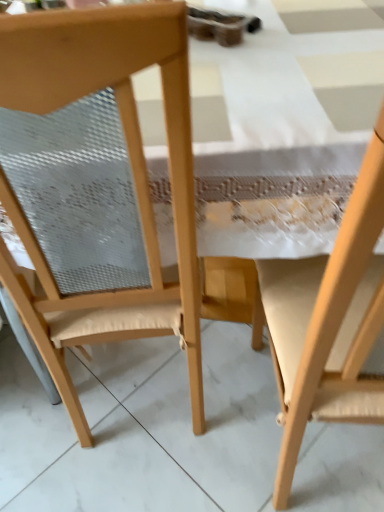
At what (x,y) coordinates should I click in order to perform the action: click on wooden chair at left, arranged as the 2th chair when viewed from the right. Please return your answer as a coordinate pair (x, y). The height and width of the screenshot is (512, 384). Looking at the image, I should click on (95, 184).

What do you see at coordinates (95, 184) in the screenshot? This screenshot has width=384, height=512. I see `wooden chair at left, arranged as the 2th chair when viewed from the right` at bounding box center [95, 184].

You are a GUI agent. You are given a task and a screenshot of the screen. Output one action in this format:
    pyautogui.click(x=<x>, y=<y>)
    Task: Click on the wooden chair at right, marked as the first chair in a right-to-left arrangement
    
    Given the screenshot: What is the action you would take?
    pyautogui.click(x=330, y=322)

Image resolution: width=384 pixels, height=512 pixels. Describe the element at coordinates (330, 322) in the screenshot. I see `wooden chair at right, which is the second chair from left to right` at that location.

Where is `wooden chair at left, arranged as the 2th chair when viewed from the right`? Image resolution: width=384 pixels, height=512 pixels. wooden chair at left, arranged as the 2th chair when viewed from the right is located at coordinates (95, 184).

Would you say wooden chair at left, arranged as the 2th chair when viewed from the right, is to the left or to the right of wooden chair at right, marked as the first chair in a right-to-left arrangement, in the picture?

wooden chair at left, arranged as the 2th chair when viewed from the right, is to the left of wooden chair at right, marked as the first chair in a right-to-left arrangement.

Relative to wooden chair at right, marked as the first chair in a right-to-left arrangement, is wooden chair at left, arranged as the 2th chair when viewed from the right, in front or behind?

In the image, wooden chair at left, arranged as the 2th chair when viewed from the right, appears behind wooden chair at right, marked as the first chair in a right-to-left arrangement.

Which point is more distant from viewer, (192, 298) or (301, 384)?

Positioned behind is point (192, 298).

From the image's perspective, would you say wooden chair at left, arranged as the 2th chair when viewed from the right, is shown under wooden chair at right, marked as the first chair in a right-to-left arrangement?

Incorrect, from the image's perspective, wooden chair at left, arranged as the 2th chair when viewed from the right, is higher than wooden chair at right, marked as the first chair in a right-to-left arrangement.

From a real-world perspective, does wooden chair at left, placed as the first chair when sorted from left to right, sit lower than wooden chair at right, marked as the first chair in a right-to-left arrangement?

Yes.

Between wooden chair at left, arranged as the 2th chair when viewed from the right, and wooden chair at right, marked as the first chair in a right-to-left arrangement, which one has smaller width?

With smaller width is wooden chair at left, arranged as the 2th chair when viewed from the right.

Can you confirm if wooden chair at left, arranged as the 2th chair when viewed from the right, is taller than wooden chair at right, marked as the first chair in a right-to-left arrangement?

Yes.

Does wooden chair at left, placed as the first chair when sorted from left to right, have a smaller size compared to wooden chair at right, which is the second chair from left to right?

Indeed, wooden chair at left, placed as the first chair when sorted from left to right, has a smaller size compared to wooden chair at right, which is the second chair from left to right.

Would you say wooden chair at left, arranged as the 2th chair when viewed from the right, is inside or outside wooden chair at right, marked as the first chair in a right-to-left arrangement?

wooden chair at left, arranged as the 2th chair when viewed from the right, is outside wooden chair at right, marked as the first chair in a right-to-left arrangement.

Does wooden chair at left, arranged as the 2th chair when viewed from the right, touch wooden chair at right, which is the second chair from left to right?

wooden chair at left, arranged as the 2th chair when viewed from the right, is not next to wooden chair at right, which is the second chair from left to right, and they're not touching.

Is wooden chair at left, arranged as the 2th chair when viewed from the right, positioned with its back to wooden chair at right, which is the second chair from left to right?

No, wooden chair at left, arranged as the 2th chair when viewed from the right, is not facing away from wooden chair at right, which is the second chair from left to right.

Locate an element on the screen. chair that is above the wooden chair at right, marked as the first chair in a right-to-left arrangement (from the image's perspective) is located at coordinates (95, 184).

Considering the relative positions of wooden chair at right, marked as the first chair in a right-to-left arrangement, and wooden chair at left, placed as the first chair when sorted from left to right, in the image provided, is wooden chair at right, marked as the first chair in a right-to-left arrangement, to the left or to the right of wooden chair at left, placed as the first chair when sorted from left to right,?

wooden chair at right, marked as the first chair in a right-to-left arrangement, is to the right of wooden chair at left, placed as the first chair when sorted from left to right.

Between wooden chair at right, marked as the first chair in a right-to-left arrangement, and wooden chair at left, placed as the first chair when sorted from left to right, which one is positioned behind?

Positioned behind is wooden chair at left, placed as the first chair when sorted from left to right.

Considering the points (301, 392) and (132, 106), which point is in front, point (301, 392) or point (132, 106)?

The point (132, 106) is closer to the camera.

In the scene shown: From the image's perspective, which object appears higher, wooden chair at right, which is the second chair from left to right, or wooden chair at left, placed as the first chair when sorted from left to right?

wooden chair at left, placed as the first chair when sorted from left to right, appears higher in the image.

From a real-world perspective, who is located lower, wooden chair at right, marked as the first chair in a right-to-left arrangement, or wooden chair at left, placed as the first chair when sorted from left to right?

wooden chair at left, placed as the first chair when sorted from left to right, is physically lower.

Can you confirm if wooden chair at right, which is the second chair from left to right, is thinner than wooden chair at left, placed as the first chair when sorted from left to right?

No, wooden chair at right, which is the second chair from left to right, is not thinner than wooden chair at left, placed as the first chair when sorted from left to right.

In terms of height, does wooden chair at right, marked as the first chair in a right-to-left arrangement, look taller or shorter compared to wooden chair at left, placed as the first chair when sorted from left to right?

In the image, wooden chair at right, marked as the first chair in a right-to-left arrangement, appears to be shorter than wooden chair at left, placed as the first chair when sorted from left to right.

From the picture: Which of these two, wooden chair at right, which is the second chair from left to right, or wooden chair at left, arranged as the 2th chair when viewed from the right, is smaller?

Smaller between the two is wooden chair at left, arranged as the 2th chair when viewed from the right.

Which is correct: wooden chair at right, marked as the first chair in a right-to-left arrangement, is inside wooden chair at left, arranged as the 2th chair when viewed from the right, or outside of it?

wooden chair at right, marked as the first chair in a right-to-left arrangement, is located beyond the bounds of wooden chair at left, arranged as the 2th chair when viewed from the right.

Is wooden chair at right, marked as the first chair in a right-to-left arrangement, not near wooden chair at left, arranged as the 2th chair when viewed from the right?

No, wooden chair at right, marked as the first chair in a right-to-left arrangement, is not far away from wooden chair at left, arranged as the 2th chair when viewed from the right.

Is wooden chair at left, placed as the first chair when sorted from left to right, at the back of wooden chair at right, which is the second chair from left to right?

No, wooden chair at right, which is the second chair from left to right, is not facing the opposite direction of wooden chair at left, placed as the first chair when sorted from left to right.

This screenshot has height=512, width=384. Find the location of `chair behind the wooden chair at right, which is the second chair from left to right`. chair behind the wooden chair at right, which is the second chair from left to right is located at coordinates (95, 184).

Where is `chair on the left of wooden chair at right, which is the second chair from left to right`? This screenshot has width=384, height=512. chair on the left of wooden chair at right, which is the second chair from left to right is located at coordinates pos(95,184).

Locate an element on the screen. The image size is (384, 512). chair above the wooden chair at left, placed as the first chair when sorted from left to right (from a real-world perspective) is located at coordinates (330, 322).